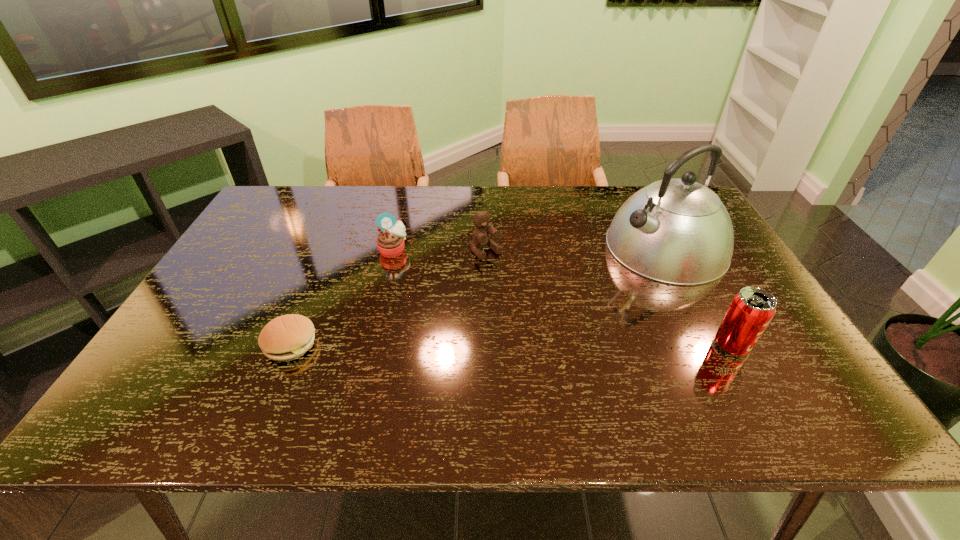
I want to click on soda can that is at the right edge, so click(x=751, y=310).

Identify the location of kettle that is at the right edge. The image size is (960, 540). (677, 231).

This screenshot has height=540, width=960. I want to click on object present at the far right corner, so click(677, 231).

Locate an element on the screen. This screenshot has width=960, height=540. object at the near right corner is located at coordinates (751, 310).

The height and width of the screenshot is (540, 960). Find the location of `vacant space at the far edge of the desktop`. vacant space at the far edge of the desktop is located at coordinates (438, 214).

In the image, there is a desktop. Where is `vacant space at the near edge`? vacant space at the near edge is located at coordinates (492, 366).

The height and width of the screenshot is (540, 960). I want to click on vacant space at the left edge, so click(267, 278).

The width and height of the screenshot is (960, 540). In the image, there is a desktop. In order to click on free space at the right edge in this screenshot , I will do `click(708, 288)`.

In the image, there is a desktop. Identify the location of vacant space at the far right corner. (644, 186).

The height and width of the screenshot is (540, 960). In order to click on free region at the near right corner of the desktop in this screenshot , I will do `click(785, 356)`.